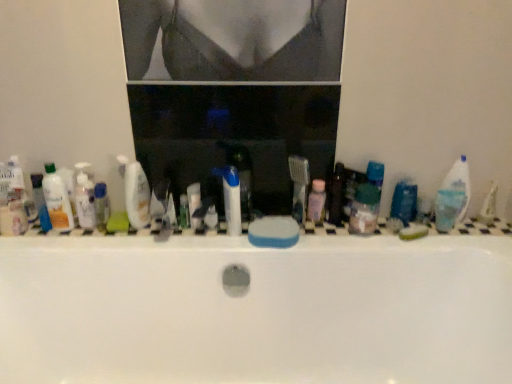
Question: In terms of width, does pink translucent bottle at center, the 4th toiletry positioned from the left, look wider or thinner when compared to translucent plastic mouthwash at left, positioned as the 1th mouthwash in left-to-right order?

Choices:
 (A) wide
 (B) thin

Answer: (B)

Question: Is pink translucent bottle at center, the 4th toiletry positioned from the left, taller or shorter than translucent plastic mouthwash at left, the 3th mouthwash when ordered from right to left?

Choices:
 (A) short
 (B) tall

Answer: (A)

Question: Considering the real-world distances, which object is closest to the pink translucent bottle at center, the 4th toiletry positioned from the left?

Choices:
 (A) translucent plastic bottle at left, the 2th toiletry when ordered from left to right
 (B) white glossy bottle at center, which ranks as the third toiletry in left-to-right order
 (C) white glossy toothpaste at center
 (D) green matte bar of soap at right, which is counted as the 1th soap, starting from the right
 (E) translucent plastic bottle at left, which ranks as the 4th toiletry in right-to-left order

Answer: (C)

Question: Which object is positioned farthest from the translucent plastic mouthwash at left, the 2th mouthwash from the left?

Choices:
 (A) green matte bar of soap at right, the 2th soap viewed from the left
 (B) white glossy toothpaste at center
 (C) translucent plastic container at center, which appears as the first mouthwash when viewed from the right
 (D) transparent plastic medicine cabinet at center
 (E) translucent plastic bottle at left, which ranks as the 3th toiletry in right-to-left order

Answer: (A)